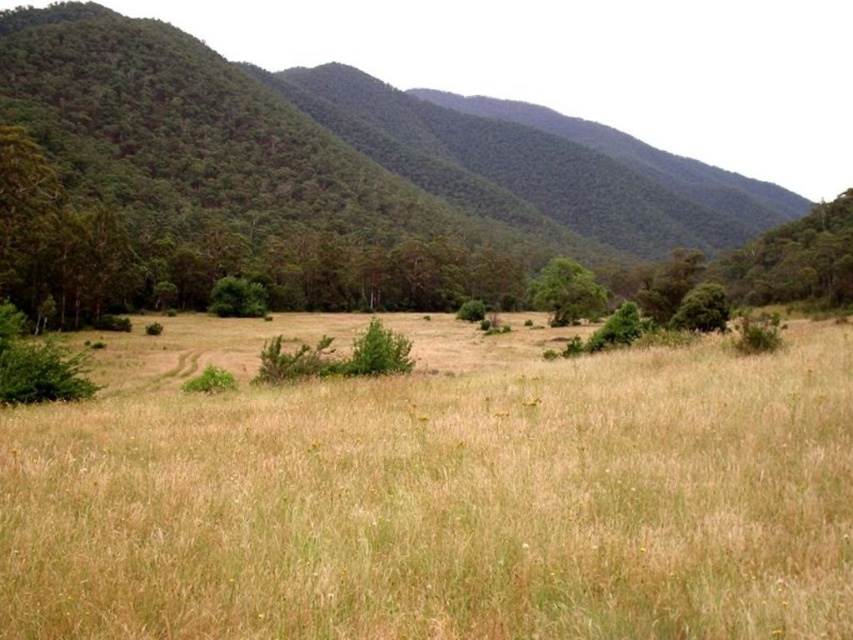
Can you confirm if dry grass at center is positioned to the left of green forested mountain at center?

Yes, dry grass at center is to the left of green forested mountain at center.

Is dry grass at center shorter than green forested mountain at center?

Yes.

Between point (291, 564) and point (325, 301), which one is positioned in front?

Point (291, 564)

Find the location of a particular element. This screenshot has width=853, height=640. dry grass at center is located at coordinates (445, 504).

Does green forested mountain at center appear on the right side of green leafy tree at center?

In fact, green forested mountain at center is to the left of green leafy tree at center.

Where is `green forested mountain at center`? Image resolution: width=853 pixels, height=640 pixels. green forested mountain at center is located at coordinates (355, 184).

Between point (210, 173) and point (554, 259), which one is positioned in front?

Point (554, 259) is more forward.

Find the location of a particular element. Image resolution: width=853 pixels, height=640 pixels. green forested mountain at center is located at coordinates (355, 184).

Is point (115, 468) positioned in front of point (547, 308)?

Yes.

Is dry grass at center positioned before green leafy tree at center?

Yes, it is.

I want to click on dry grass at center, so click(445, 504).